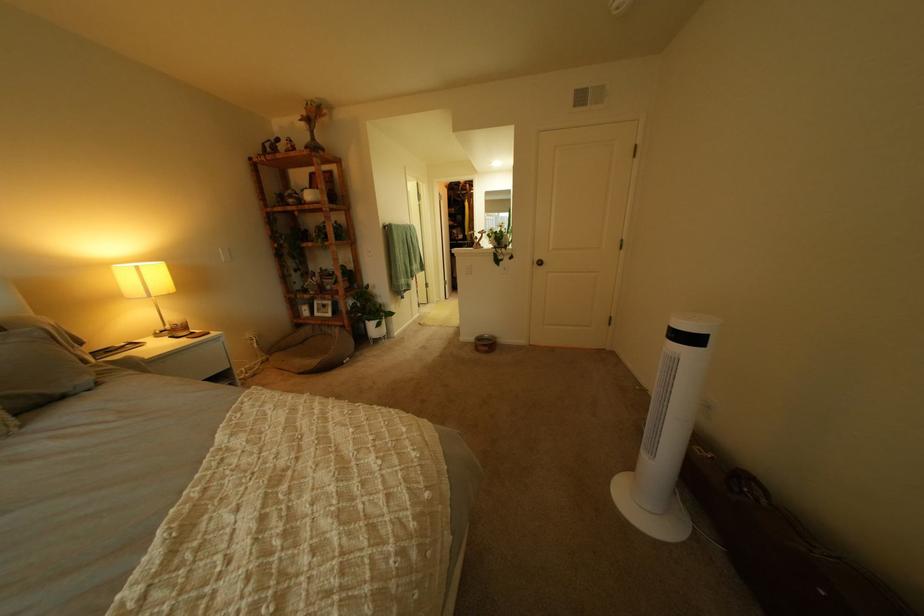
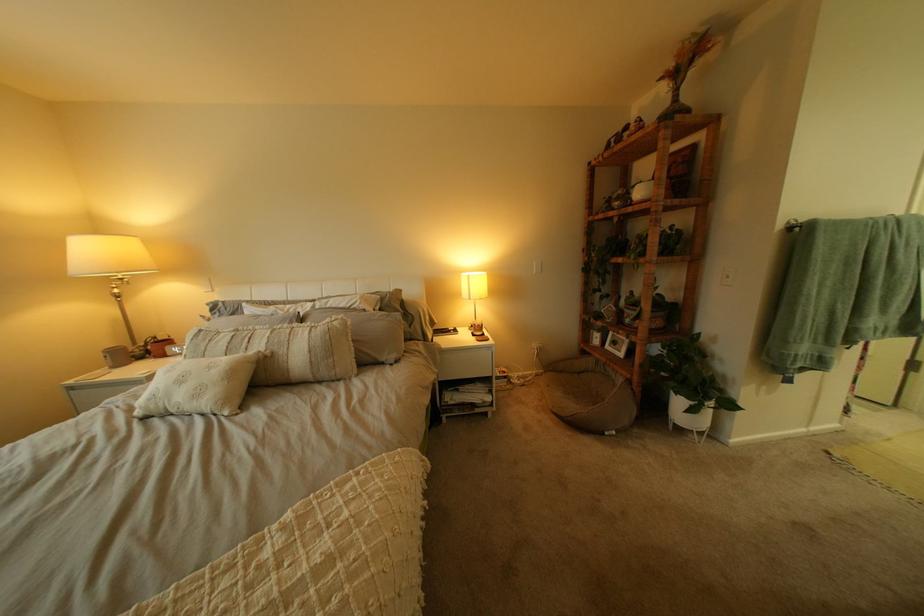
In the second image, find the point that corresponds to pixel 152 268 in the first image.

(483, 277)